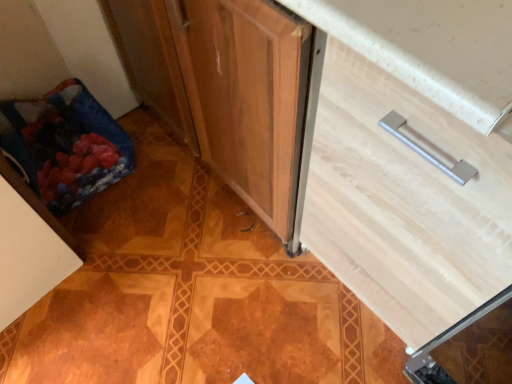
Locate an element on the screen. The height and width of the screenshot is (384, 512). blue fabric bag at lower left is located at coordinates (65, 145).

This screenshot has height=384, width=512. Describe the element at coordinates (28, 256) in the screenshot. I see `white matte cabinet at lower left` at that location.

The image size is (512, 384). What do you see at coordinates (405, 201) in the screenshot?
I see `light wood drawer at center` at bounding box center [405, 201].

This screenshot has height=384, width=512. I want to click on blue fabric bag at lower left, so pyautogui.click(x=65, y=145).

Does blue fabric bag at lower left touch light wood drawer at center?

They are not placed beside each other.

Between blue fabric bag at lower left and light wood drawer at center, which one appears on the left side from the viewer's perspective?

Positioned to the left is blue fabric bag at lower left.

Who is shorter, blue fabric bag at lower left or light wood drawer at center?

With less height is blue fabric bag at lower left.

Based on their sizes in the image, would you say white matte cabinet at lower left is bigger or smaller than blue fabric bag at lower left?

white matte cabinet at lower left is bigger than blue fabric bag at lower left.

Considering the relative positions of white matte cabinet at lower left and blue fabric bag at lower left in the image provided, is white matte cabinet at lower left to the right of blue fabric bag at lower left from the viewer's perspective?

No, white matte cabinet at lower left is not to the right of blue fabric bag at lower left.

From the image's perspective, relative to blue fabric bag at lower left, is white matte cabinet at lower left above or below?

Based on their image positions, white matte cabinet at lower left is located beneath blue fabric bag at lower left.

Based on the photo, is white matte cabinet at lower left situated inside blue fabric bag at lower left or outside?

white matte cabinet at lower left is not inside blue fabric bag at lower left, it's outside.

Would you say white matte cabinet at lower left is inside or outside light wood drawer at center?

white matte cabinet at lower left is not enclosed by light wood drawer at center.

In the scene shown: From a real-world perspective, relative to light wood drawer at center, is white matte cabinet at lower left vertically above or below?

In terms of real-world spatial position, white matte cabinet at lower left is below light wood drawer at center.

Would you consider white matte cabinet at lower left to be distant from light wood drawer at center?

Actually, white matte cabinet at lower left and light wood drawer at center are a little close together.

How much distance is there between white matte cabinet at lower left and light wood drawer at center?

white matte cabinet at lower left is 31.00 inches away from light wood drawer at center.

In the scene shown: From a real-world perspective, which is physically below, light wood drawer at center or white matte cabinet at lower left?

From a 3D spatial view, white matte cabinet at lower left is below.

Which of these two, light wood drawer at center or white matte cabinet at lower left, is bigger?

With larger size is light wood drawer at center.

Are light wood drawer at center and white matte cabinet at lower left located far from each other?

light wood drawer at center is near white matte cabinet at lower left, not far away.

From the image's perspective, is light wood drawer at center positioned above or below white matte cabinet at lower left?

light wood drawer at center is above white matte cabinet at lower left.

Who is more distant, blue fabric bag at lower left or white matte cabinet at lower left?

blue fabric bag at lower left is further away from the camera.

From the image's perspective, is blue fabric bag at lower left below white matte cabinet at lower left?

No.

Are blue fabric bag at lower left and white matte cabinet at lower left beside each other?

No, blue fabric bag at lower left is not next to white matte cabinet at lower left.

Is light wood drawer at center bigger than blue fabric bag at lower left?

Correct, light wood drawer at center is larger in size than blue fabric bag at lower left.

From a real-world perspective, who is located higher, light wood drawer at center or blue fabric bag at lower left?

light wood drawer at center.

Where is `drawer on the right of the blue fabric bag at lower left`? This screenshot has height=384, width=512. drawer on the right of the blue fabric bag at lower left is located at coordinates (405, 201).

Does light wood drawer at center touch blue fabric bag at lower left?

→ light wood drawer at center and blue fabric bag at lower left are clearly separated.

This screenshot has width=512, height=384. I want to click on material that is on the left side of light wood drawer at center, so tap(65, 145).

The image size is (512, 384). Find the location of `cabinetry located below the blue fabric bag at lower left (from the image's perspective)`. cabinetry located below the blue fabric bag at lower left (from the image's perspective) is located at coordinates [x=28, y=256].

When comparing their distances from white matte cabinet at lower left, does light wood drawer at center or blue fabric bag at lower left seem further?

Based on the image, light wood drawer at center appears to be further to white matte cabinet at lower left.

From the image, which object appears to be farther from white matte cabinet at lower left, blue fabric bag at lower left or light wood drawer at center?

The object further to white matte cabinet at lower left is light wood drawer at center.

Considering their positions, is white matte cabinet at lower left positioned closer to light wood drawer at center than blue fabric bag at lower left?

white matte cabinet at lower left.

Which object lies nearer to the anchor point blue fabric bag at lower left, light wood drawer at center or white matte cabinet at lower left?

white matte cabinet at lower left is closer to blue fabric bag at lower left.

Considering their positions, is white matte cabinet at lower left positioned closer to blue fabric bag at lower left than light wood drawer at center?

Based on the image, white matte cabinet at lower left appears to be nearer to blue fabric bag at lower left.

Which object lies nearer to the anchor point light wood drawer at center, blue fabric bag at lower left or white matte cabinet at lower left?

white matte cabinet at lower left.

Locate an element on the screen. Image resolution: width=512 pixels, height=384 pixels. material located between white matte cabinet at lower left and light wood drawer at center in the left-right direction is located at coordinates (65, 145).